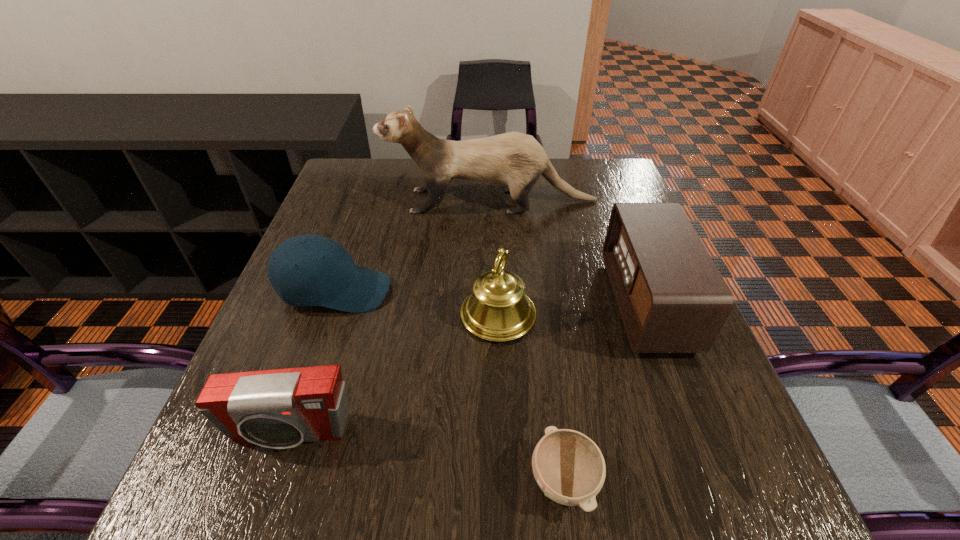
Identify the location of vacant area at the near right corner of the desktop. (777, 510).

The height and width of the screenshot is (540, 960). Find the location of `empty location between the radio receiver and the camera`. empty location between the radio receiver and the camera is located at coordinates (468, 368).

The image size is (960, 540). I want to click on empty space that is in between the camera and the radio receiver, so click(468, 368).

At what (x,y) coordinates should I click in order to perform the action: click on blank region between the baseball cap and the camera. Please return your answer as a coordinate pair (x, y). This screenshot has width=960, height=540. Looking at the image, I should click on (312, 362).

Where is `vacant area that lies between the baseball cap and the shortest object`? vacant area that lies between the baseball cap and the shortest object is located at coordinates (450, 386).

Image resolution: width=960 pixels, height=540 pixels. In order to click on free spot between the baseball cap and the bell in this screenshot , I will do `click(417, 303)`.

The width and height of the screenshot is (960, 540). Identify the location of free space between the bowl and the bell. (531, 398).

The width and height of the screenshot is (960, 540). In order to click on free space between the bell and the shortest object in this screenshot , I will do `click(531, 398)`.

At what (x,y) coordinates should I click in order to perform the action: click on empty space that is in between the baseball cap and the shortest object. Please return your answer as a coordinate pair (x, y). Looking at the image, I should click on (450, 386).

This screenshot has width=960, height=540. I want to click on object that ranks as the fifth closest to the camera, so click(516, 160).